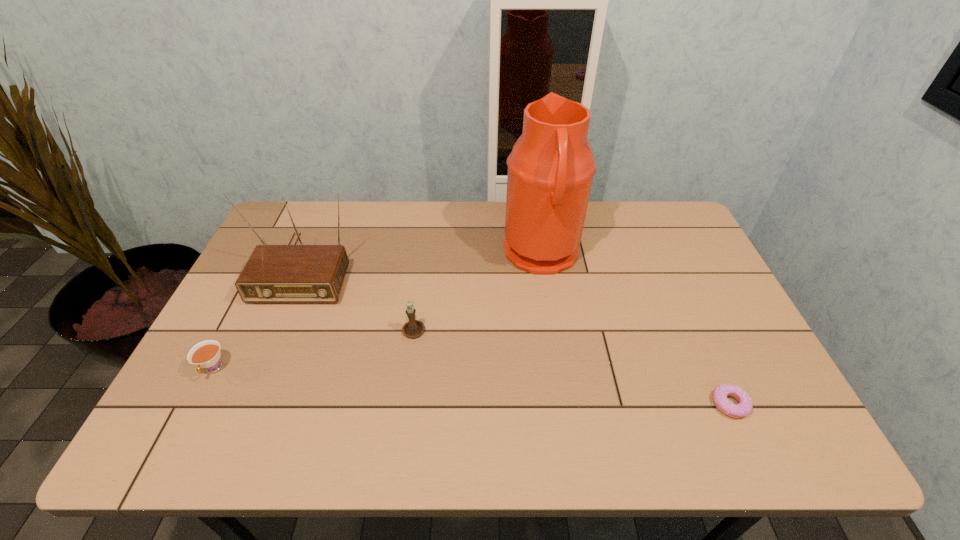
Where is `vacant area that lies between the second shortest object and the second object from right to left`? vacant area that lies between the second shortest object and the second object from right to left is located at coordinates (377, 312).

Identify the location of vacant space that is in between the radio_receiver and the water jug. (423, 260).

Image resolution: width=960 pixels, height=540 pixels. Identify the location of the third closest object relative to the radio_receiver. (550, 170).

Identify which object is the third nearest to the second object from right to left. Please provide its 2D coordinates. Your answer should be formatted as a tuple, i.e. [(x, y)], where the tuple contains the x and y coordinates of a point satisfying the conditions above.

[(288, 273)]

Locate an element on the screen. The image size is (960, 540). free space that satisfies the following two spatial constraints: 1. from the spout of the water jug; 2. on the side of the teacup with the handle is located at coordinates (559, 368).

Where is `free space that satisfies the following two spatial constraints: 1. on the front panel of the doughnut; 2. on the right side of the radio_receiver`? free space that satisfies the following two spatial constraints: 1. on the front panel of the doughnut; 2. on the right side of the radio_receiver is located at coordinates (248, 404).

Where is `free space that satisfies the following two spatial constraints: 1. from the spout of the tallest object; 2. on the back side of the nearest object`? The height and width of the screenshot is (540, 960). free space that satisfies the following two spatial constraints: 1. from the spout of the tallest object; 2. on the back side of the nearest object is located at coordinates (564, 404).